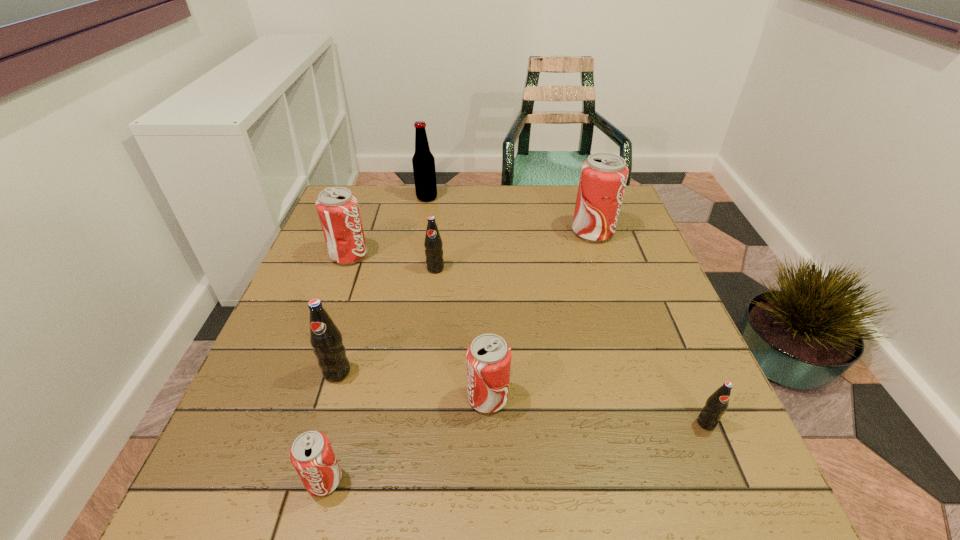
This screenshot has height=540, width=960. Identify the location of the rightmost object. (717, 403).

Identify the location of the rightmost soda can. The width and height of the screenshot is (960, 540). (717, 403).

Locate an element on the screen. This screenshot has height=540, width=960. the nearest object is located at coordinates (311, 454).

Find the location of a particular element. the second pink soda can from left to right is located at coordinates (311, 454).

You are a GUI agent. You are given a task and a screenshot of the screen. Output one action in this format:
    pyautogui.click(x=<x>, y=<y>)
    Task: Click on the free space located 0.250m on the front of the beer bottle
    This screenshot has width=960, height=540.
    Given the screenshot: What is the action you would take?
    pyautogui.click(x=418, y=253)

Where is `free space located on the left of the biggest pink soda can`? The width and height of the screenshot is (960, 540). free space located on the left of the biggest pink soda can is located at coordinates (551, 232).

Locate an element on the screen. The image size is (960, 540). vacant space positioned 0.170m on the front label of the second farthest black pop is located at coordinates (308, 468).

Identify the location of free space located on the front of the second biggest pink soda can. This screenshot has width=960, height=540. (328, 314).

Where is `blank area located 0.170m on the front label of the farthest black pop`? This screenshot has height=540, width=960. blank area located 0.170m on the front label of the farthest black pop is located at coordinates tap(429, 323).

The image size is (960, 540). What are the coordinates of `free space located 0.240m on the left of the third object from right to left` in the screenshot? It's located at (342, 398).